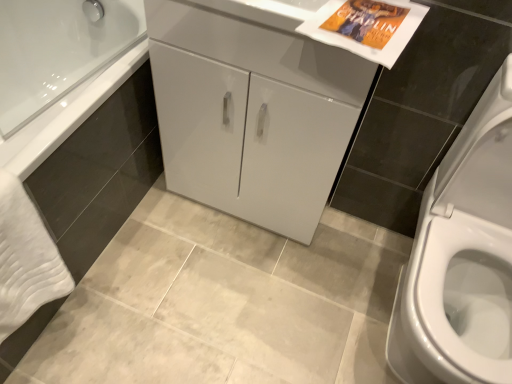
What do you see at coordinates (26, 259) in the screenshot?
I see `white soft towel at lower left` at bounding box center [26, 259].

Measure the distance between point (329, 153) and camera.

Point (329, 153) is 3.85 feet from camera.

I want to click on white soft towel at lower left, so click(x=26, y=259).

From a real-world perspective, is white soft towel at lower left physically below white glossy cabinet at center?

Yes.

Relative to white glossy cabinet at center, is white soft towel at lower left in front or behind?

Visually, white soft towel at lower left is located in front of white glossy cabinet at center.

Could you tell me if white soft towel at lower left is facing white glossy cabinet at center?

No, white soft towel at lower left is not oriented towards white glossy cabinet at center.

Does white soft towel at lower left contain white glossy cabinet at center?

No, white glossy cabinet at center is not inside white soft towel at lower left.

Can you confirm if white glossy cabinet at center is smaller than white soft towel at lower left?

No.

Considering the sizes of objects white glossy cabinet at center and white soft towel at lower left in the image provided, who is shorter, white glossy cabinet at center or white soft towel at lower left?

white soft towel at lower left.

From a real-world perspective, is white glossy cabinet at center on top of white soft towel at lower left?

Indeed, from a real-world perspective, white glossy cabinet at center stands above white soft towel at lower left.

Which of these two, white glossy cabinet at center or white glossy cabinet at center, is bigger?

Bigger between the two is white glossy cabinet at center.

From the image's perspective, is white glossy cabinet at center on top of white glossy cabinet at center?

Indeed, from the image's perspective, white glossy cabinet at center is shown above white glossy cabinet at center.

Is white glossy cabinet at center far from white glossy cabinet at center?

No, white glossy cabinet at center is in close proximity to white glossy cabinet at center.

Visually, is white glossy cabinet at center positioned to the left or to the right of white glossy cabinet at center?

white glossy cabinet at center is to the right of white glossy cabinet at center.

Would you say white glossy cabinet at center is inside or outside white soft towel at lower left?

The correct answer is: outside.

Considering the sizes of objects white glossy cabinet at center and white soft towel at lower left in the image provided, who is taller, white glossy cabinet at center or white soft towel at lower left?

white soft towel at lower left.

Which is closer to the camera, (x=226, y=55) or (x=5, y=258)?

The point (x=5, y=258) is in front.

Is white glossy cabinet at center with white glossy cabinet at center?

white glossy cabinet at center and white glossy cabinet at center are not in contact.

From the picture: Does white glossy cabinet at center appear on the left side of white glossy cabinet at center?

Yes.

Does white glossy cabinet at center have a lesser height compared to white glossy cabinet at center?

No, white glossy cabinet at center is not shorter than white glossy cabinet at center.

Considering the positions of point (185, 72) and point (217, 51), is point (185, 72) closer or farther from the camera than point (217, 51)?

Clearly, point (185, 72) is more distant from the camera than point (217, 51).

From a real-world perspective, who is located lower, white soft towel at lower left or white glossy cabinet at center?

In real-world perspective, white soft towel at lower left is lower.

Is white soft towel at lower left smaller than white glossy cabinet at center?

Yes, white soft towel at lower left is smaller than white glossy cabinet at center.

Image resolution: width=512 pixels, height=384 pixels. Identify the location of bath towel that is on the left side of white glossy cabinet at center. (26, 259).

How far apart are white soft towel at lower left and white glossy cabinet at center?

65.48 centimeters.

At what (x,y) coordinates should I click in order to perform the action: click on bathroom cabinet lying above the white soft towel at lower left (from the image's perspective). Please return your answer as a coordinate pair (x, y). The height and width of the screenshot is (384, 512). Looking at the image, I should click on (252, 115).

At what (x,y) coordinates should I click in order to perform the action: click on bathroom cabinet that is on the right side of white soft towel at lower left. Please return your answer as a coordinate pair (x, y). The height and width of the screenshot is (384, 512). Looking at the image, I should click on (x=252, y=115).

Consider the image. Based on their spatial positions, is white glossy cabinet at center or white soft towel at lower left further from white glossy cabinet at center?

Among the two, white soft towel at lower left is located further to white glossy cabinet at center.

Based on the photo, which object lies nearer to the anchor point white glossy cabinet at center, white glossy cabinet at center or white soft towel at lower left?

The object closer to white glossy cabinet at center is white glossy cabinet at center.

Based on their spatial positions, is white glossy cabinet at center or white glossy cabinet at center further from white soft towel at lower left?

white glossy cabinet at center is further to white soft towel at lower left.

Estimate the real-world distances between objects in this image. Which object is further from white soft towel at lower left, white glossy cabinet at center or white glossy cabinet at center?

Among the two, white glossy cabinet at center is located further to white soft towel at lower left.

Looking at the image, which one is located closer to white glossy cabinet at center, white soft towel at lower left or white glossy cabinet at center?

The object closer to white glossy cabinet at center is white glossy cabinet at center.

When comparing their distances from white glossy cabinet at center, does white soft towel at lower left or white glossy cabinet at center seem further?

white soft towel at lower left.

Locate an element on the screen. This screenshot has height=384, width=512. bathroom cabinet situated between white soft towel at lower left and white glossy cabinet at center from left to right is located at coordinates 252,115.